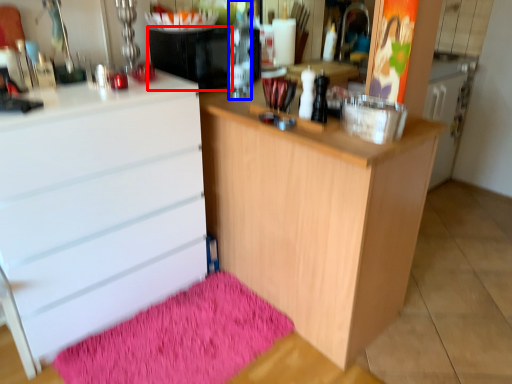
Question: Which object is closer to the camera taking this photo, appliance (highlighted by a red box) or bottle (highlighted by a blue box)?

Choices:
 (A) appliance
 (B) bottle

Answer: (B)